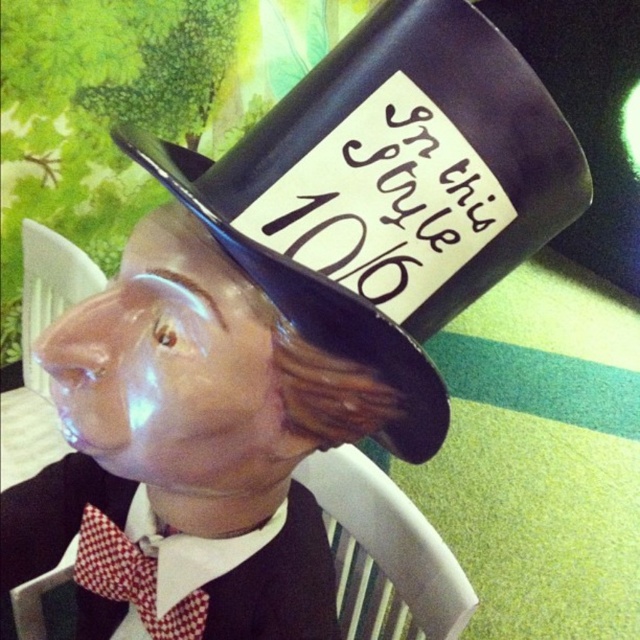
You are a fashion designer creating a miniature outfit for a pig figurine. The pig has a black glossy top hat at center and a red checkered fabric tie at center. Which accessory do you think requires more fabric to make?

The black glossy top hat at center requires more fabric because it is bigger than the red checkered fabric tie at center.

You are an interior designer arranging a shelf. You have a black glossy top hat at center that needs to be placed at coordinates 0.300, 0.609. The shelf has a coordinate system where the bottom left corner is 0,0 and the top right corner is 1,1. Can you confirm if the hat will fit within the shelf dimensions?

The black glossy top hat at center is located at coordinates (388,192), which falls within the shelf dimensions from (0,0) to (639,639), so it will fit.

You are a fashion designer examining the pig figurine. You need to determine the spatial relationship between the black glossy top hat at center and the red checkered fabric tie at center. Which object is located to the right of the other?

The black glossy top hat at center is positioned on the right side of red checkered fabric tie at center.